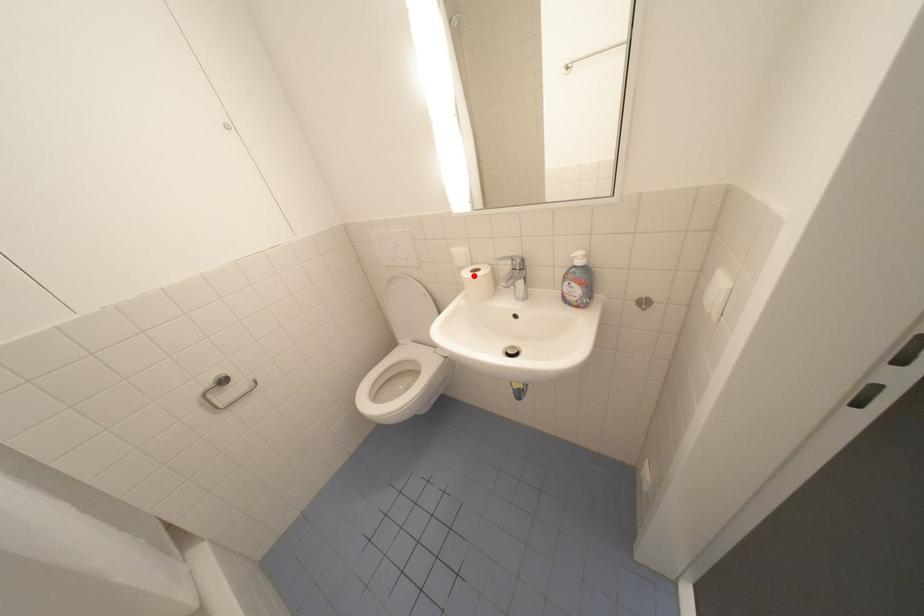
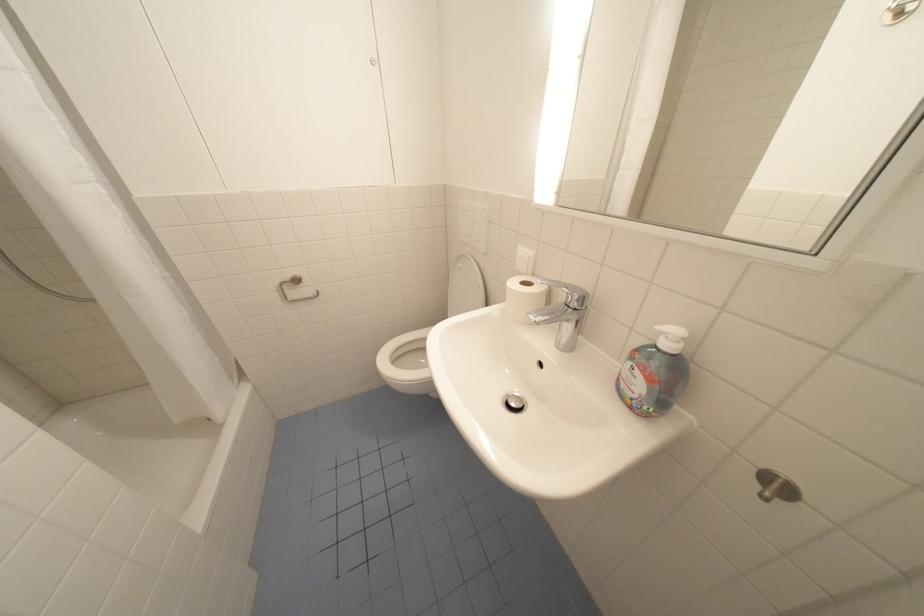
The point at the highlighted location is marked in the first image. Where is the corresponding point in the second image?

(520, 284)